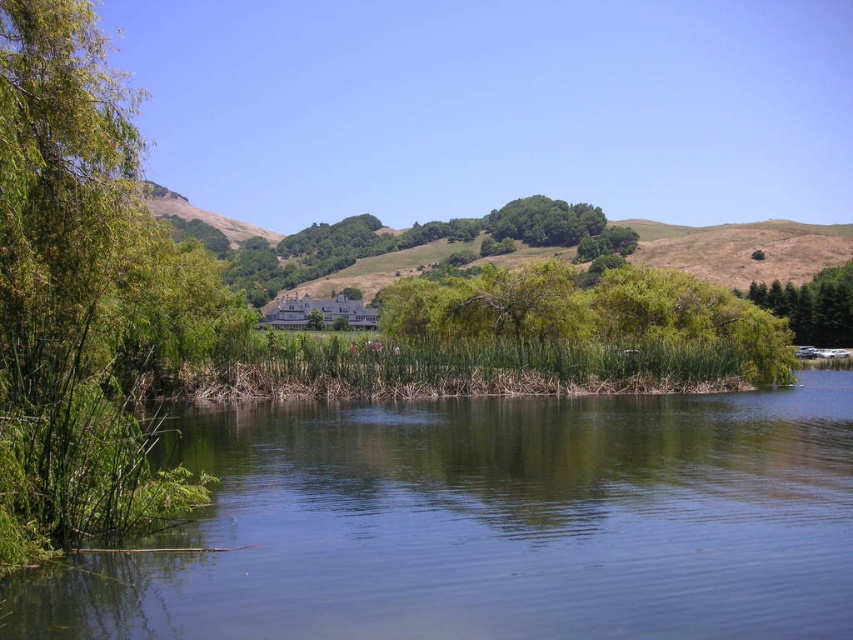
Question: Can you confirm if green leafy bush at center is thinner than green leafy tree at right?

Choices:
 (A) yes
 (B) no

Answer: (A)

Question: Does green leafy tree at left have a greater width compared to green leafy bush at center?

Choices:
 (A) no
 (B) yes

Answer: (A)

Question: Which of the following is the farthest from the observer?

Choices:
 (A) green leafy tree at right
 (B) green leafy bush at center
 (C) green leafy tree at left
 (D) green grassy river at center

Answer: (A)

Question: Can you confirm if green leafy tree at left is bigger than green leafy tree at right?

Choices:
 (A) yes
 (B) no

Answer: (B)

Question: Which object is positioned closest to the green leafy bush at center?

Choices:
 (A) green leafy tree at left
 (B) green leafy tree at right

Answer: (A)

Question: Estimate the real-world distances between objects in this image. Which object is closer to the green leafy bush at center?

Choices:
 (A) green leafy tree at left
 (B) green leafy tree at right

Answer: (A)